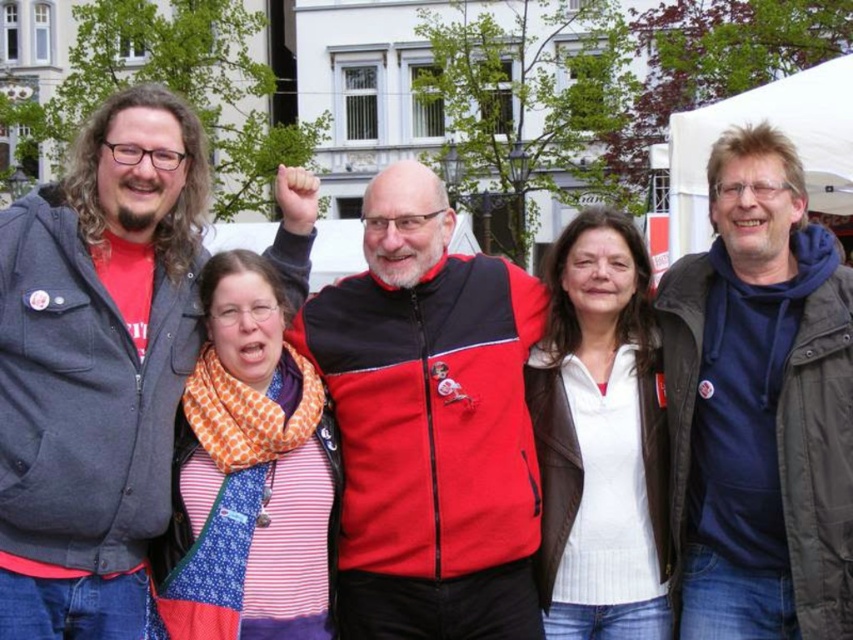
Question: Which of the following is the closest to the observer?

Choices:
 (A) matte gray jacket at left
 (B) red fleece jacket at center

Answer: (A)

Question: Which of the following is the closest to the observer?

Choices:
 (A) matte gray jacket at left
 (B) dark blue fleece at right
 (C) red fleece jacket at center
 (D) white matte jacket at center

Answer: (A)

Question: Does matte gray jacket at left come in front of dark blue fleece at right?

Choices:
 (A) yes
 (B) no

Answer: (A)

Question: Does matte gray jacket at left have a greater width compared to red fleece jacket at center?

Choices:
 (A) no
 (B) yes

Answer: (B)

Question: Is matte gray jacket at left below dark blue fleece at right?

Choices:
 (A) no
 (B) yes

Answer: (A)

Question: Among these objects, which one is farthest from the camera?

Choices:
 (A) red fleece jacket at center
 (B) white matte jacket at center
 (C) matte gray jacket at left

Answer: (B)